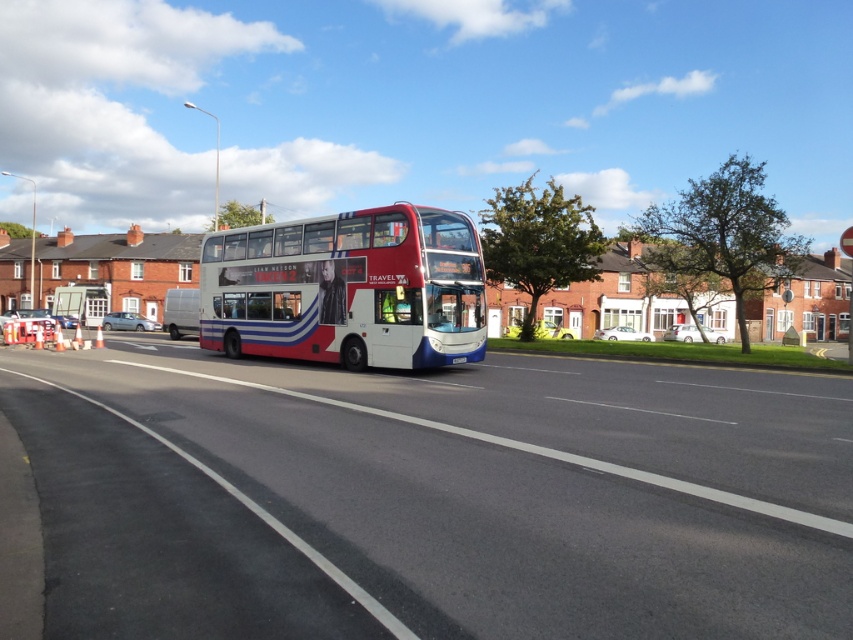
You are a pedestrian standing on the sidewalk and want to cross the road to reach the white plastic license plate at center. Is the white glossy decker bus at center blocking your path?

The white glossy decker bus at center is closer to the viewer than the white plastic license plate at center, so the bus is blocking the path to the license plate.

You are a pedestrian standing on the sidewalk and see the white glossy decker bus at center and the white plastic license plate at center. Which object is closer to the left edge of the road?

The white glossy decker bus at center is positioned on the left side of the white plastic license plate at center, so it is closer to the left edge of the road.

You are a delivery person trying to park your 2.5m tall van in a parking spot that has a height restriction of 3 meters. You see the white glossy decker bus at center and the white plastic license plate at center in the image. Based on their sizes, can your van safely park there?

The white glossy decker bus at center is much taller than the white plastic license plate at center. Since the bus is taller than the license plate, and your van is 2.5 meters tall, which is under the 3 meter restriction, your van can safely park there as long as the height restriction is respected.